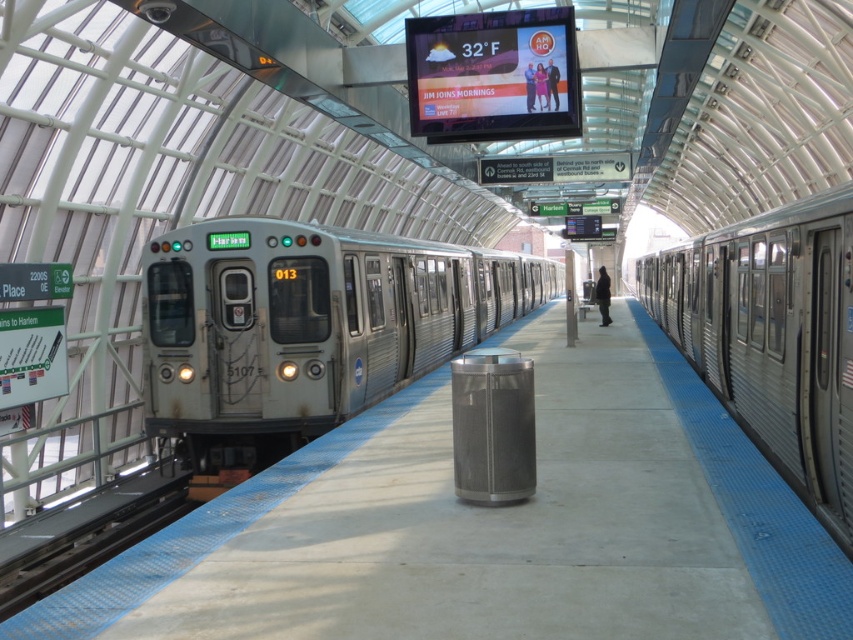
Does rusty metal train at center appear under silver metallic train at right?

Correct, rusty metal train at center is located below silver metallic train at right.

Which is more to the left, rusty metal train at center or silver metallic train at right?

From the viewer's perspective, rusty metal train at center appears more on the left side.

Locate an element on the screen. The height and width of the screenshot is (640, 853). rusty metal train at center is located at coordinates (305, 328).

This screenshot has width=853, height=640. Identify the location of rusty metal train at center. (305, 328).